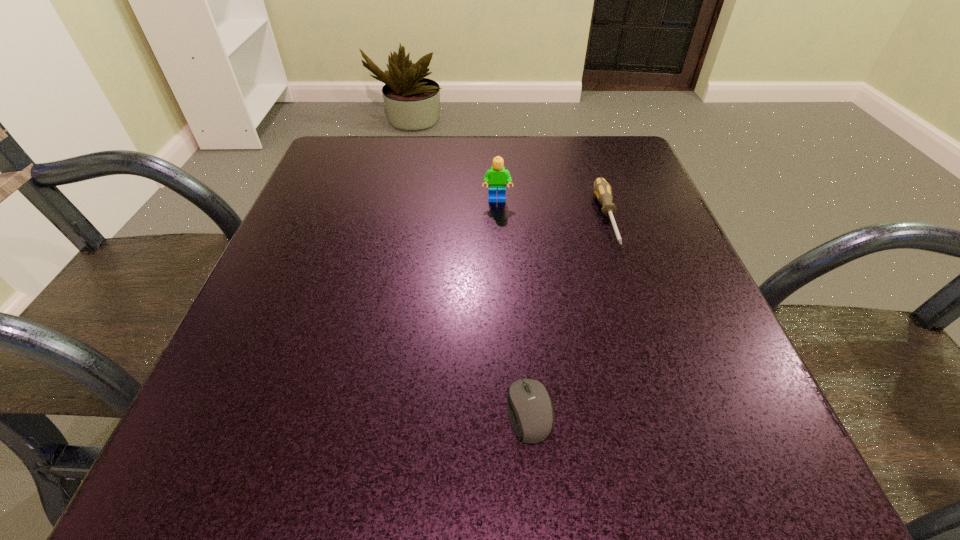
Locate which object is the second closest to the rightmost object. Please provide its 2D coordinates. Your answer should be formatted as a tuple, i.e. [(x, y)], where the tuple contains the x and y coordinates of a point satisfying the conditions above.

[(530, 410)]

Where is `blank area in the image that satisfies the following two spatial constraints: 1. on the face of the Lego; 2. on the left side of the shortest object`? blank area in the image that satisfies the following two spatial constraints: 1. on the face of the Lego; 2. on the left side of the shortest object is located at coordinates (507, 411).

The width and height of the screenshot is (960, 540). In order to click on free space that satisfies the following two spatial constraints: 1. on the face of the computer equipment; 2. on the right side of the Lego in this screenshot , I will do `click(507, 411)`.

Locate an element on the screen. This screenshot has height=540, width=960. vacant space that satisfies the following two spatial constraints: 1. on the face of the Lego; 2. on the right side of the computer equipment is located at coordinates (507, 411).

Locate an element on the screen. free spot that satisfies the following two spatial constraints: 1. on the face of the shortest object; 2. on the left side of the tallest object is located at coordinates (507, 411).